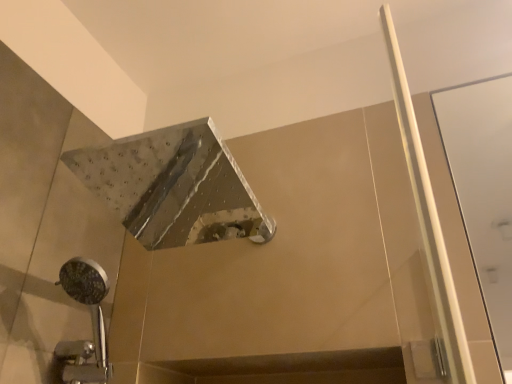
Identify the location of polished metallic showerhead at upper center. This screenshot has width=512, height=384. (174, 186).

This screenshot has width=512, height=384. Describe the element at coordinates (174, 186) in the screenshot. I see `polished metallic showerhead at upper center` at that location.

Where is `polished metallic showerhead at upper center`? The height and width of the screenshot is (384, 512). polished metallic showerhead at upper center is located at coordinates (174, 186).